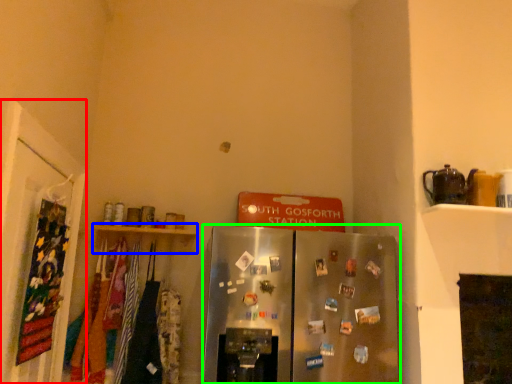
Question: Based on their relative distances, which object is nearer to door (highlighted by a red box)? Choose from shelf (highlighted by a blue box) and refrigerator (highlighted by a green box).

Choices:
 (A) shelf
 (B) refrigerator

Answer: (A)